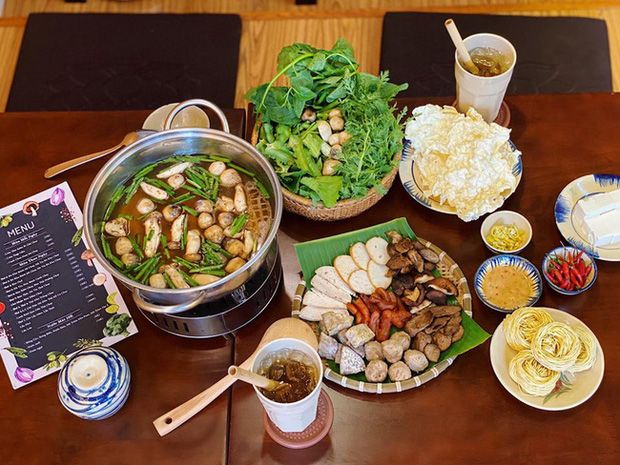
Image resolution: width=620 pixels, height=465 pixels. I want to click on pot handle, so click(169, 309), click(231, 112).